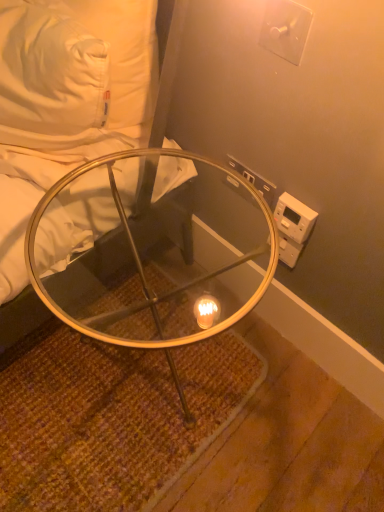
What do you see at coordinates (285, 29) in the screenshot?
I see `white plastic switch at upper right, the first electric outlet when ordered from front to back` at bounding box center [285, 29].

This screenshot has width=384, height=512. I want to click on white plastic switch at upper right, the first electric outlet when ordered from front to back, so click(x=285, y=29).

Looking at this image, in order to face clear glass table at center, should I rotate leftwards or rightwards?

To face it directly, rotate left by 4.736 degrees.

The width and height of the screenshot is (384, 512). What do you see at coordinates (65, 101) in the screenshot? I see `clear glass table at lower left` at bounding box center [65, 101].

Where is `white plastic electrical outlet at upper right, positioned as the first electric outlet in bottom-to-top order`? white plastic electrical outlet at upper right, positioned as the first electric outlet in bottom-to-top order is located at coordinates (254, 180).

Which object is closer to the camera, white plastic switch at upper right, the first electric outlet when ordered from top to bottom, or white plastic electrical outlet at upper right, the 1th electric outlet from the back?

Positioned in front is white plastic switch at upper right, the first electric outlet when ordered from top to bottom.

Does white plastic switch at upper right, marked as the 2th electric outlet in a bottom-to-top arrangement, have a larger size compared to white plastic electrical outlet at upper right, which is the second electric outlet in front-to-back order?

Yes, white plastic switch at upper right, marked as the 2th electric outlet in a bottom-to-top arrangement, is bigger than white plastic electrical outlet at upper right, which is the second electric outlet in front-to-back order.

Consider the image. From a real-world perspective, is white plastic switch at upper right, marked as the 2th electric outlet in a bottom-to-top arrangement, positioned above or below white plastic electrical outlet at upper right, the 1th electric outlet from the back?

Clearly, from a real-world perspective, white plastic switch at upper right, marked as the 2th electric outlet in a bottom-to-top arrangement, is above white plastic electrical outlet at upper right, the 1th electric outlet from the back.

Is white plastic switch at upper right, which is the second electric outlet from back to front, positioned with its back to white plastic electrical outlet at upper right, which is the second electric outlet in front-to-back order?

white plastic switch at upper right, which is the second electric outlet from back to front, is not turned away from white plastic electrical outlet at upper right, which is the second electric outlet in front-to-back order.

Is clear glass table at center at the right side of white plastic switch at upper right, which is the second electric outlet from back to front?

In fact, clear glass table at center is to the left of white plastic switch at upper right, which is the second electric outlet from back to front.

Between clear glass table at center and white plastic switch at upper right, the first electric outlet when ordered from front to back, which one has smaller width?

With smaller width is white plastic switch at upper right, the first electric outlet when ordered from front to back.

From a real-world perspective, relative to white plastic switch at upper right, marked as the 2th electric outlet in a bottom-to-top arrangement, is clear glass table at center vertically above or below?

clear glass table at center is situated lower than white plastic switch at upper right, marked as the 2th electric outlet in a bottom-to-top arrangement, in the real world.

Can you tell me how much clear glass table at center and white plastic switch at upper right, which is the second electric outlet from back to front, differ in facing direction?

The angular difference between clear glass table at center and white plastic switch at upper right, which is the second electric outlet from back to front, is 0.182 degrees.

Which is in front, clear glass table at lower left or white plastic electrical outlet at upper right, positioned as the first electric outlet in bottom-to-top order?

clear glass table at lower left.

I want to click on the 2nd electric outlet positioned below the clear glass table at lower left (from the image's perspective), so click(x=254, y=180).

From a real-world perspective, is clear glass table at lower left positioned above or below white plastic electrical outlet at upper right, positioned as the first electric outlet in bottom-to-top order?

Clearly, from a real-world perspective, clear glass table at lower left is above white plastic electrical outlet at upper right, positioned as the first electric outlet in bottom-to-top order.

Image resolution: width=384 pixels, height=512 pixels. I want to click on table in front of the white plastic electrical outlet at upper right, which is the second electric outlet in front-to-back order, so click(150, 251).

Is point (261, 239) closer or farther from the camera than point (237, 162)?

Point (261, 239) is positioned farther from the camera compared to point (237, 162).

Is clear glass table at center placed right next to white plastic electrical outlet at upper right, which is the second electric outlet in front-to-back order?

No, clear glass table at center is not with white plastic electrical outlet at upper right, which is the second electric outlet in front-to-back order.

Which object is closer to the camera, clear glass table at center or white plastic electrical outlet at upper right, positioned as the first electric outlet in bottom-to-top order?

clear glass table at center is closer to the camera.

From a real-world perspective, is clear glass table at lower left positioned under white plastic switch at upper right, the first electric outlet when ordered from front to back, based on gravity?

Yes, from a real-world perspective, clear glass table at lower left is beneath white plastic switch at upper right, the first electric outlet when ordered from front to back.

Does clear glass table at lower left have a smaller size compared to white plastic switch at upper right, which is the second electric outlet from back to front?

No.

Which object is positioned more to the left, clear glass table at lower left or white plastic switch at upper right, marked as the 2th electric outlet in a bottom-to-top arrangement?

clear glass table at lower left is more to the left.

Is clear glass table at lower left far away from white plastic switch at upper right, marked as the 2th electric outlet in a bottom-to-top arrangement?

They are positioned close to each other.

Could you tell me if white plastic electrical outlet at upper right, positioned as the second electric outlet in top-to-bottom order, is facing clear glass table at center?

Yes, white plastic electrical outlet at upper right, positioned as the second electric outlet in top-to-bottom order, faces towards clear glass table at center.

From the image's perspective, which is below, white plastic electrical outlet at upper right, the 1th electric outlet from the back, or clear glass table at center?

clear glass table at center.

Considering the positions of objects white plastic electrical outlet at upper right, which is the second electric outlet in front-to-back order, and clear glass table at lower left in the image provided, who is in front, white plastic electrical outlet at upper right, which is the second electric outlet in front-to-back order, or clear glass table at lower left?

clear glass table at lower left is in front.

From a real-world perspective, which is physically above, white plastic electrical outlet at upper right, the 1th electric outlet from the back, or clear glass table at lower left?

clear glass table at lower left.

Are white plastic electrical outlet at upper right, positioned as the first electric outlet in bottom-to-top order, and clear glass table at lower left making contact?

There is a gap between white plastic electrical outlet at upper right, positioned as the first electric outlet in bottom-to-top order, and clear glass table at lower left.

Is white plastic electrical outlet at upper right, the 1th electric outlet from the back, looking in the opposite direction of clear glass table at lower left?

No.

At what (x,y) coordinates should I click in order to perform the action: click on electric outlet in front of the white plastic electrical outlet at upper right, positioned as the first electric outlet in bottom-to-top order. Please return your answer as a coordinate pair (x, y). Looking at the image, I should click on (285, 29).

The width and height of the screenshot is (384, 512). There is a clear glass table at center. What are the coordinates of `the 2nd electric outlet above it (from the image's perspective)` in the screenshot? It's located at (285, 29).

Considering their positions, is clear glass table at center positioned closer to clear glass table at lower left than white plastic switch at upper right, which is the second electric outlet from back to front?

A: clear glass table at center is positioned closer to the anchor clear glass table at lower left.

From the image, which object appears to be farther from white plastic electrical outlet at upper right, positioned as the first electric outlet in bottom-to-top order, white plastic switch at upper right, marked as the 2th electric outlet in a bottom-to-top arrangement, or clear glass table at center?

clear glass table at center.

Based on their spatial positions, is white plastic switch at upper right, the first electric outlet when ordered from top to bottom, or white plastic electrical outlet at upper right, positioned as the first electric outlet in bottom-to-top order, closer to clear glass table at lower left?

Based on the image, white plastic electrical outlet at upper right, positioned as the first electric outlet in bottom-to-top order, appears to be nearer to clear glass table at lower left.

When comparing their distances from clear glass table at center, does clear glass table at lower left or white plastic switch at upper right, the first electric outlet when ordered from front to back, seem further?

The object further to clear glass table at center is white plastic switch at upper right, the first electric outlet when ordered from front to back.

From the image, which object appears to be farther from white plastic electrical outlet at upper right, positioned as the first electric outlet in bottom-to-top order, clear glass table at center or white plastic switch at upper right, the first electric outlet when ordered from top to bottom?

clear glass table at center.

Looking at the image, which one is located closer to white plastic switch at upper right, the first electric outlet when ordered from top to bottom, clear glass table at center or clear glass table at lower left?

clear glass table at lower left.

Looking at the image, which one is located further to clear glass table at center, white plastic switch at upper right, the first electric outlet when ordered from front to back, or clear glass table at lower left?

The object further to clear glass table at center is white plastic switch at upper right, the first electric outlet when ordered from front to back.

Looking at the image, which one is located closer to clear glass table at center, white plastic electrical outlet at upper right, positioned as the first electric outlet in bottom-to-top order, or clear glass table at lower left?

The object closer to clear glass table at center is clear glass table at lower left.

Find the location of a particular element. This screenshot has width=384, height=512. electric outlet between white plastic switch at upper right, marked as the 2th electric outlet in a bottom-to-top arrangement, and clear glass table at center from top to bottom is located at coordinates (254, 180).

Where is `electric outlet between clear glass table at lower left and white plastic switch at upper right, the first electric outlet when ordered from top to bottom`? electric outlet between clear glass table at lower left and white plastic switch at upper right, the first electric outlet when ordered from top to bottom is located at coordinates (254, 180).

The width and height of the screenshot is (384, 512). Find the location of `table between clear glass table at lower left and white plastic switch at upper right, the first electric outlet when ordered from front to back, in the horizontal direction`. table between clear glass table at lower left and white plastic switch at upper right, the first electric outlet when ordered from front to back, in the horizontal direction is located at coordinates (150, 251).

At what (x,y) coordinates should I click in order to perform the action: click on table situated between clear glass table at lower left and white plastic electrical outlet at upper right, positioned as the first electric outlet in bottom-to-top order, from left to right. Please return your answer as a coordinate pair (x, y). Looking at the image, I should click on (150, 251).